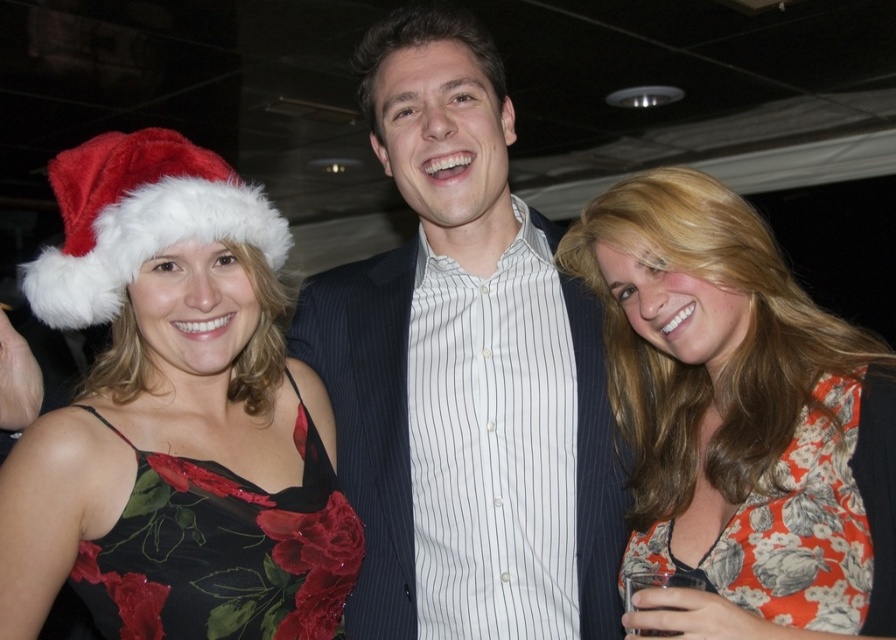
Looking at this image, does floral-patterned dress at right have a lesser height compared to floral print fabric dress at right?

No.

Does floral-patterned dress at right come behind floral print fabric dress at right?

No, it is not.

This screenshot has width=896, height=640. What do you see at coordinates (739, 419) in the screenshot?
I see `floral-patterned dress at right` at bounding box center [739, 419].

Locate an element on the screen. floral-patterned dress at right is located at coordinates (739, 419).

Is point (97, 307) farther from camera compared to point (263, 632)?

No, (97, 307) is in front of (263, 632).

Is velvet floral dress at left above black satin dress at left?

Yes.

Does point (290, 369) lie behind point (162, 632)?

Yes, it is.

This screenshot has height=640, width=896. In order to click on velvet floral dress at left in this screenshot , I will do `click(174, 417)`.

Between velvet floral dress at left and fuzzy white santa hat at left, which one is positioned higher?

fuzzy white santa hat at left

Measure the distance between velvet floral dress at left and camera.

velvet floral dress at left is 3.35 feet from camera.

The height and width of the screenshot is (640, 896). What are the coordinates of `velvet floral dress at left` in the screenshot? It's located at (174, 417).